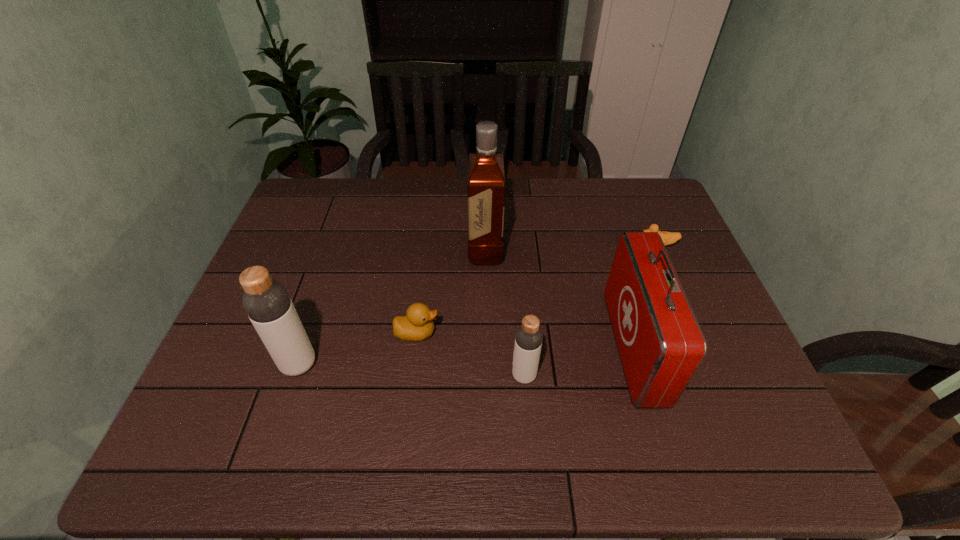
Identify the location of vacant place for an extra bottle on the right. (758, 388).